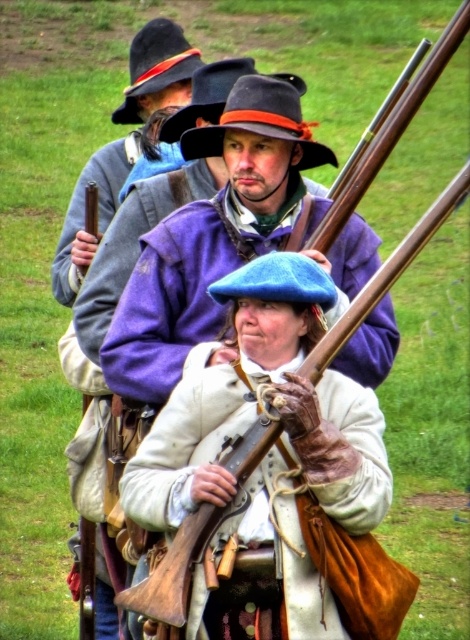
Question: Estimate the real-world distances between objects in this image. Which object is farther from the blue felt beret at center?

Choices:
 (A) blue felt beret at upper center
 (B) matte purple coat at center

Answer: (A)

Question: Is blue felt beret at center above blue felt beret at upper center?

Choices:
 (A) yes
 (B) no

Answer: (B)

Question: Which is nearer to the matte purple coat at center?

Choices:
 (A) blue felt beret at upper center
 (B) blue felt beret at center

Answer: (B)

Question: Considering the real-world distances, which object is farthest from the blue felt beret at center?

Choices:
 (A) matte purple coat at center
 (B) blue felt beret at upper center

Answer: (B)

Question: Is the position of matte purple coat at center less distant than that of blue felt beret at center?

Choices:
 (A) no
 (B) yes

Answer: (B)

Question: Does blue felt beret at center appear over blue felt beret at upper center?

Choices:
 (A) yes
 (B) no

Answer: (B)